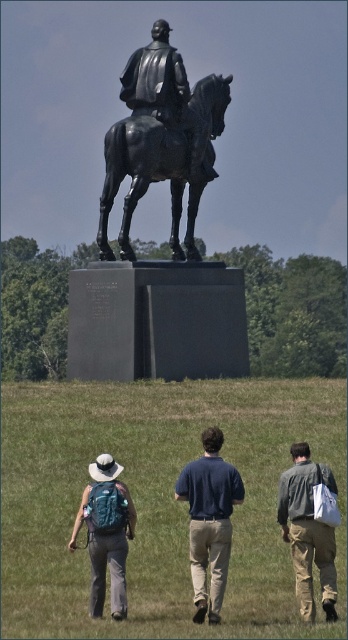
Question: From the image, what is the correct spatial relationship of denim jacket at lower right in relation to teal fabric backpack at lower left?

Choices:
 (A) above
 (B) below

Answer: (A)

Question: Which point is closer to the camera?

Choices:
 (A) (309, 468)
 (B) (175, 244)
 (C) (130, 538)

Answer: (C)

Question: Is green grass at lower center closer to camera compared to teal fabric backpack at lower left?

Choices:
 (A) no
 (B) yes

Answer: (B)

Question: Considering the real-world distances, which object is closest to the denim jacket at lower right?

Choices:
 (A) green grass at lower center
 (B) shiny black horse at center
 (C) teal fabric backpack at lower left
 (D) dark blue shirt at center

Answer: (D)

Question: Is denim jacket at lower right above teal fabric backpack at lower left?

Choices:
 (A) no
 (B) yes

Answer: (B)

Question: Which point is closer to the camera?

Choices:
 (A) denim jacket at lower right
 (B) green grass at lower center

Answer: (B)